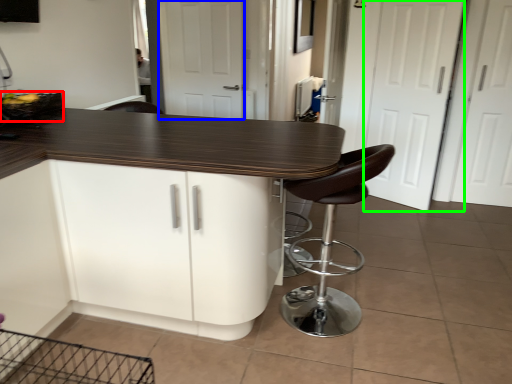
Question: Estimate the real-world distances between objects in this image. Which object is farther from basket (highlighted by a red box), screen door (highlighted by a blue box) or screen door (highlighted by a green box)?

Choices:
 (A) screen door
 (B) screen door

Answer: (B)